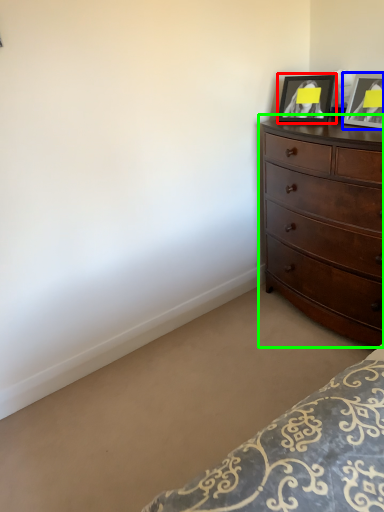
Question: Estimate the real-world distances between objects in this image. Which object is farther from picture frame (highlighted by a red box), picture frame (highlighted by a blue box) or chest of drawers (highlighted by a green box)?

Choices:
 (A) picture frame
 (B) chest of drawers

Answer: (B)